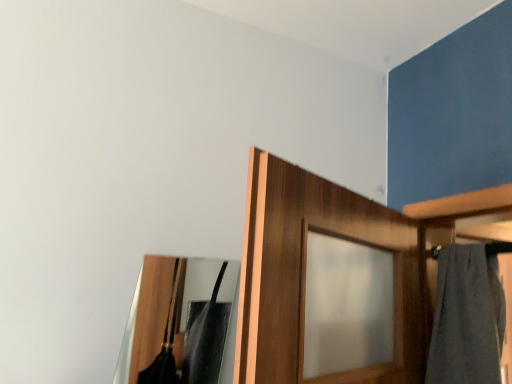
Question: Is clear glass mirror at center shorter than gray cotton bath towel at right?

Choices:
 (A) no
 (B) yes

Answer: (B)

Question: Does clear glass mirror at center appear on the left side of gray cotton bath towel at right?

Choices:
 (A) no
 (B) yes

Answer: (B)

Question: From the image's perspective, is clear glass mirror at center on gray cotton bath towel at right?

Choices:
 (A) no
 (B) yes

Answer: (A)

Question: Is clear glass mirror at center taller than gray cotton bath towel at right?

Choices:
 (A) yes
 (B) no

Answer: (B)

Question: Is clear glass mirror at center wider than gray cotton bath towel at right?

Choices:
 (A) no
 (B) yes

Answer: (A)

Question: From the image's perspective, is clear glass mirror at center below gray cotton bath towel at right?

Choices:
 (A) yes
 (B) no

Answer: (A)

Question: Considering the relative positions of gray cotton bath towel at right and clear glass mirror at center in the image provided, is gray cotton bath towel at right to the left of clear glass mirror at center from the viewer's perspective?

Choices:
 (A) no
 (B) yes

Answer: (A)

Question: Is gray cotton bath towel at right closer to the viewer compared to clear glass mirror at center?

Choices:
 (A) yes
 (B) no

Answer: (B)

Question: Is gray cotton bath towel at right wider than clear glass mirror at center?

Choices:
 (A) no
 (B) yes

Answer: (B)

Question: Is clear glass mirror at center a part of gray cotton bath towel at right?

Choices:
 (A) yes
 (B) no

Answer: (B)

Question: Is gray cotton bath towel at right to the right of clear glass mirror at center from the viewer's perspective?

Choices:
 (A) yes
 (B) no

Answer: (A)

Question: From the image's perspective, is gray cotton bath towel at right on clear glass mirror at center?

Choices:
 (A) no
 (B) yes

Answer: (B)

Question: From their relative heights in the image, would you say clear glass mirror at center is taller or shorter than gray cotton bath towel at right?

Choices:
 (A) short
 (B) tall

Answer: (A)